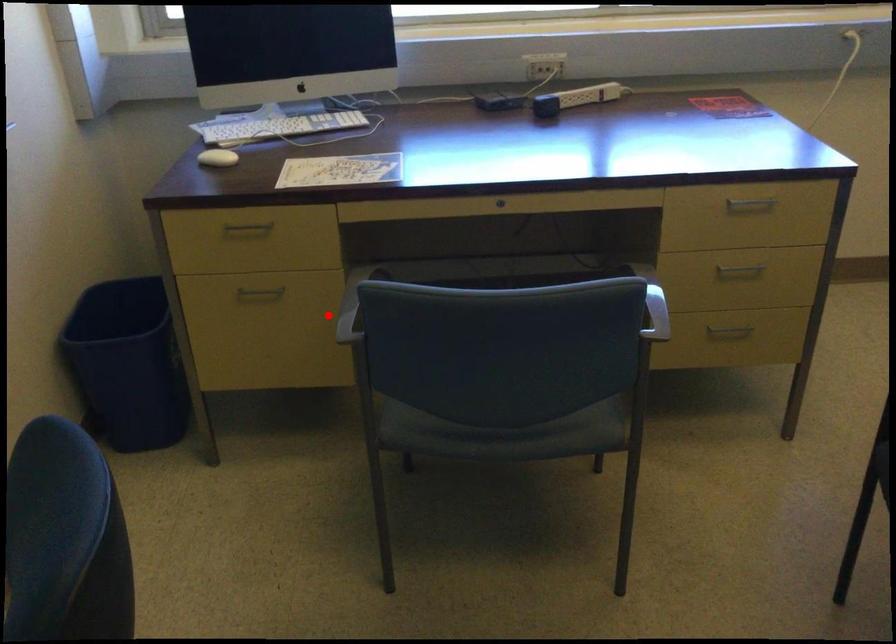
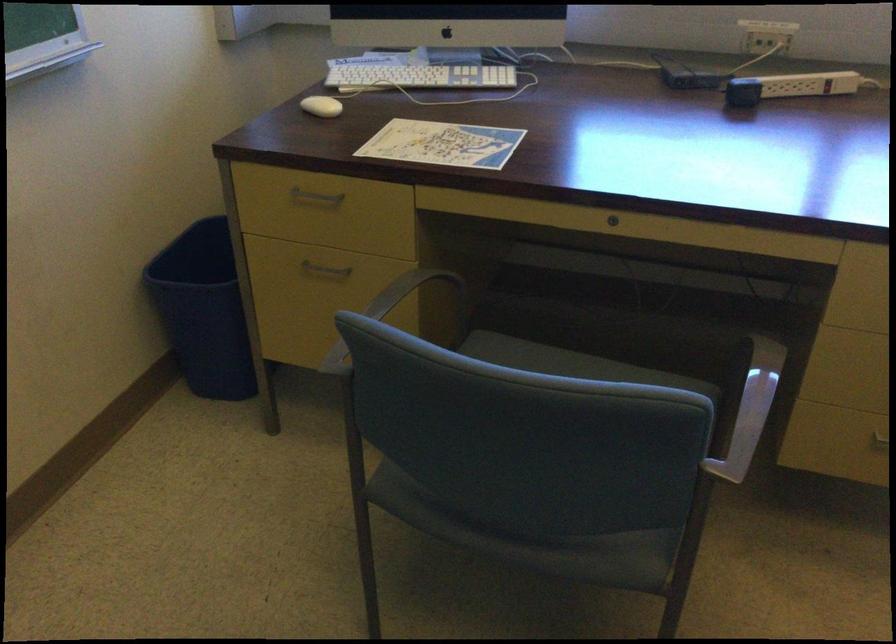
Question: I am providing you with two images of the same scene from different viewpoints. In image1, a red point is highlighted. Considering the same 3D point in image2, which of the following is correct?

Choices:
 (A) It is closer
 (B) It is farther

Answer: (A)